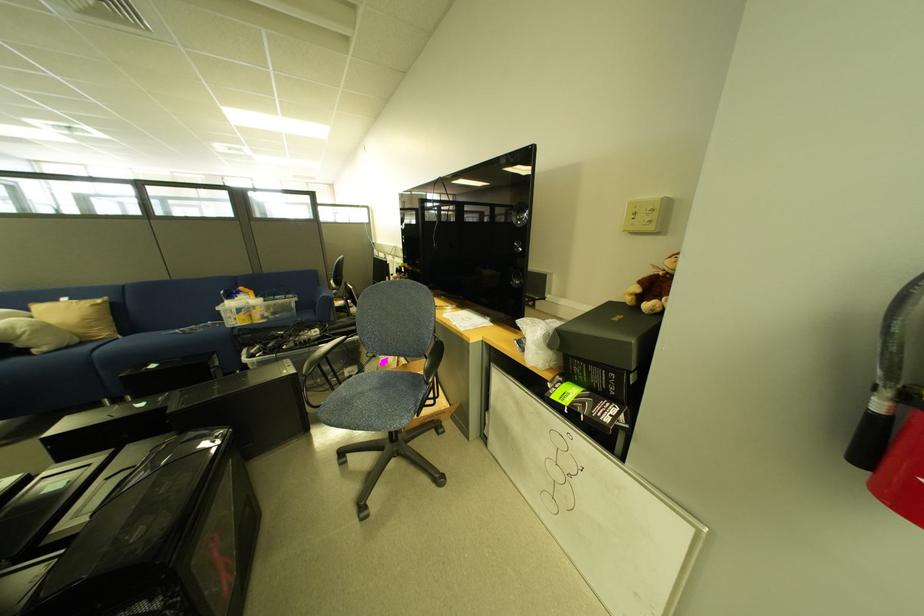
This screenshot has height=616, width=924. Identify the location of sofa armrest. (323, 304).